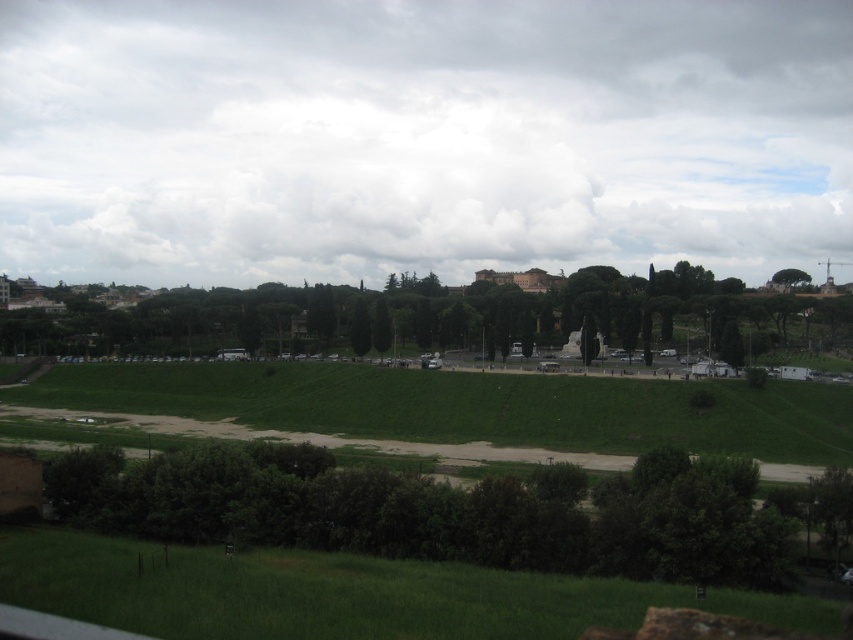
Is green leafy tree at lower center wider than green leafy tree at upper right?

Incorrect, green leafy tree at lower center's width does not surpass green leafy tree at upper right's.

I want to click on green leafy tree at lower center, so click(434, 515).

I want to click on green leafy tree at lower center, so click(434, 515).

Which is below, green grass at lower center or green leafy tree at upper right?

green grass at lower center is below.

Who is shorter, green grass at lower center or green leafy tree at upper right?

green grass at lower center

I want to click on green grass at lower center, so click(x=341, y=595).

Identify the location of green grass at lower center. This screenshot has width=853, height=640. (341, 595).

Does green leafy tree at center come in front of green grass at lower center?

No, it is not.

Is point (679, 323) less distant than point (376, 612)?

No, it is not.

You are a GUI agent. You are given a task and a screenshot of the screen. Output one action in this format:
    pyautogui.click(x=<x>, y=<y>)
    Task: Click on the green leafy tree at center
    
    Given the screenshot: What is the action you would take?
    pyautogui.click(x=431, y=316)